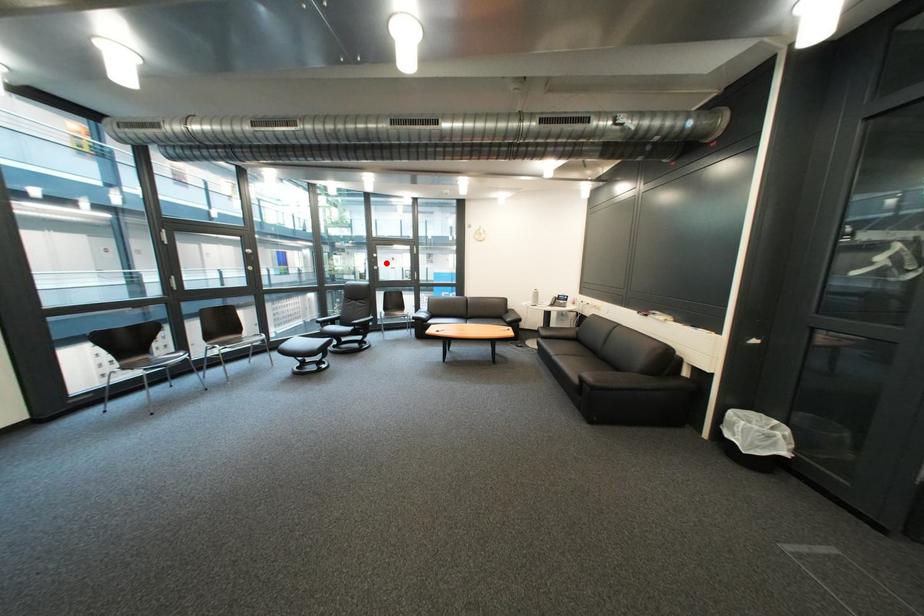
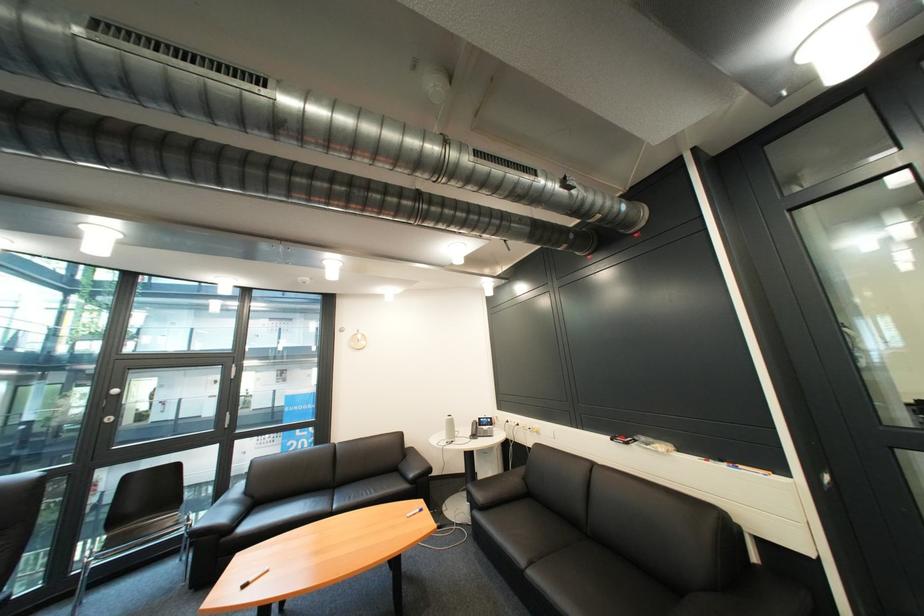
The point at the highlighted location is marked in the first image. Where is the corresponding point in the second image?

(118, 408)